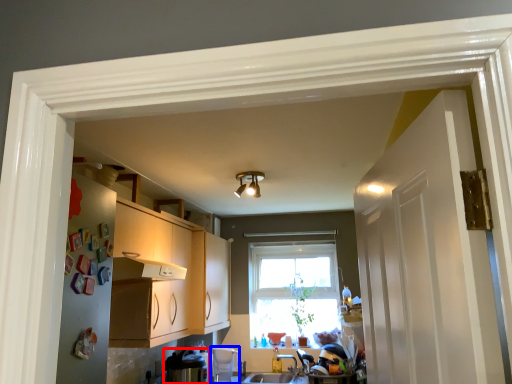
Question: Among these objects, which one is nearest to the camera, appliance (highlighted by a red box) or appliance (highlighted by a blue box)?

Choices:
 (A) appliance
 (B) appliance

Answer: (A)